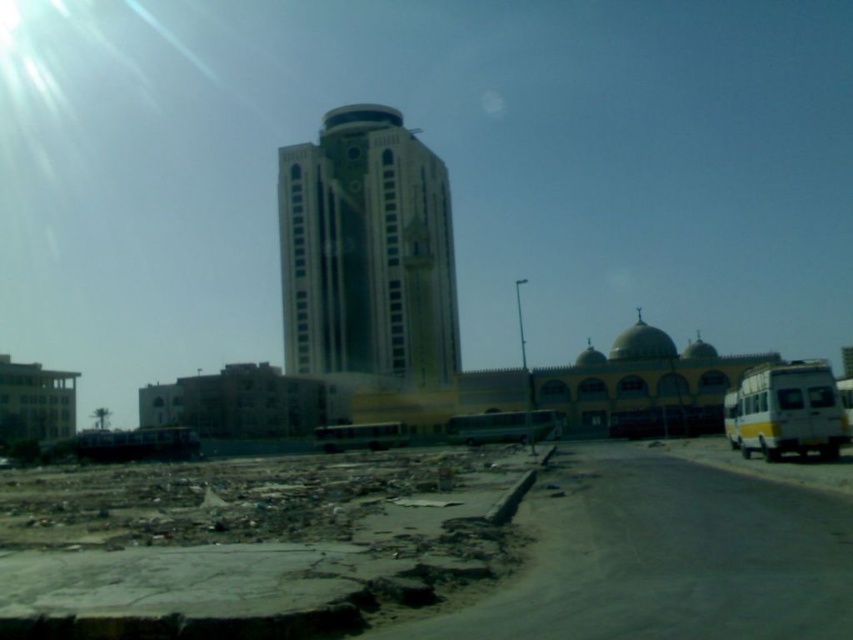
Does green metallic bus at center have a lesser width compared to yellow metallic bus at center?

Correct, green metallic bus at center's width is less than yellow metallic bus at center's.

The height and width of the screenshot is (640, 853). What do you see at coordinates (502, 426) in the screenshot? I see `green metallic bus at center` at bounding box center [502, 426].

Is point (479, 428) farther from camera compared to point (357, 438)?

No, (479, 428) is in front of (357, 438).

Find the location of a particular element. green metallic bus at center is located at coordinates (502, 426).

Does white/yellow painted bus at right have a larger size compared to green metallic bus at center?

Incorrect, white/yellow painted bus at right is not larger than green metallic bus at center.

Does white/yellow painted bus at right have a lesser height compared to green metallic bus at center?

In fact, white/yellow painted bus at right may be taller than green metallic bus at center.

Image resolution: width=853 pixels, height=640 pixels. What are the coordinates of `white/yellow painted bus at right` in the screenshot? It's located at (788, 410).

This screenshot has width=853, height=640. I want to click on white/yellow painted bus at right, so click(x=788, y=410).

Can you confirm if white glossy building at center is positioned to the left of yellow metallic bus at center?

Yes, white glossy building at center is to the left of yellow metallic bus at center.

Does white glossy building at center appear under yellow metallic bus at center?

No.

Does point (373, 113) come behind point (393, 440)?

That is True.

Where is `white glossy building at center`? This screenshot has width=853, height=640. white glossy building at center is located at coordinates (367, 252).